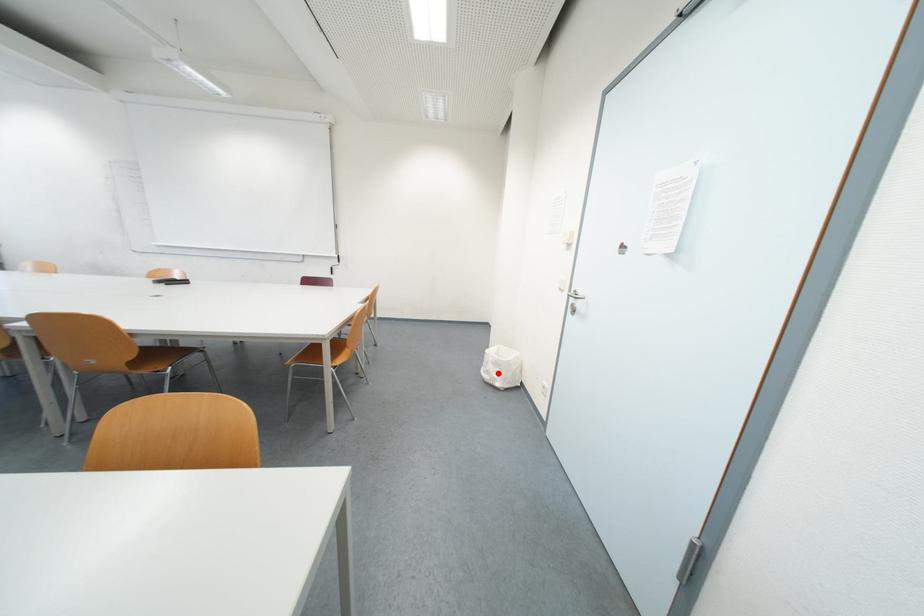
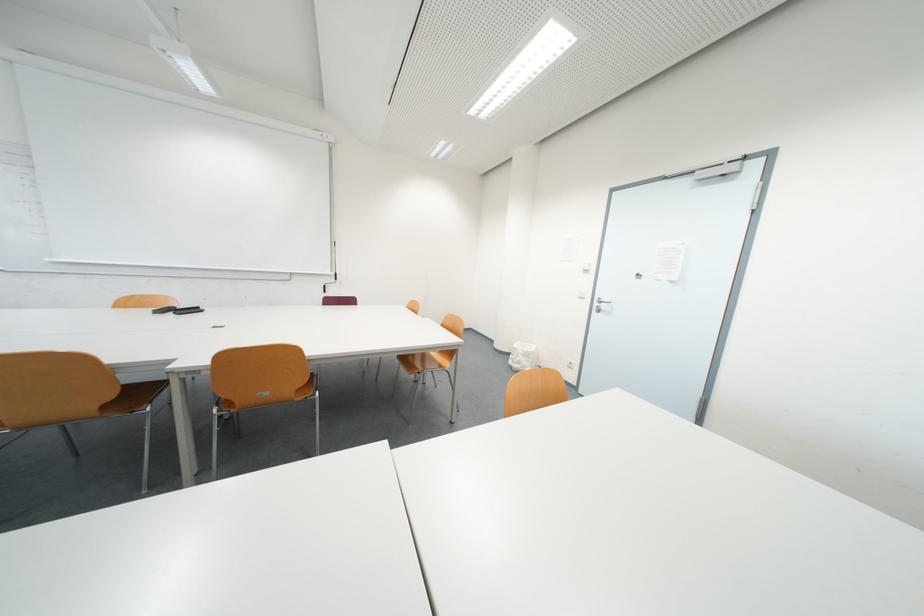
Locate, in the second image, the point that corresponds to the highlighted location in the first image.

(529, 363)